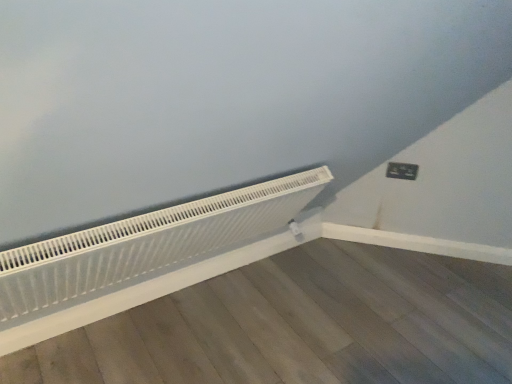
Question: Does black plastic electric outlet at upper right have a lesser height compared to white matte radiator at lower left?

Choices:
 (A) yes
 (B) no

Answer: (A)

Question: Is black plastic electric outlet at upper right not within white matte radiator at lower left?

Choices:
 (A) yes
 (B) no

Answer: (A)

Question: Is black plastic electric outlet at upper right placed right next to white matte radiator at lower left?

Choices:
 (A) yes
 (B) no

Answer: (B)

Question: Considering the relative sizes of black plastic electric outlet at upper right and white matte radiator at lower left in the image provided, is black plastic electric outlet at upper right bigger than white matte radiator at lower left?

Choices:
 (A) yes
 (B) no

Answer: (B)

Question: Is black plastic electric outlet at upper right surrounding white matte radiator at lower left?

Choices:
 (A) yes
 (B) no

Answer: (B)

Question: Does black plastic electric outlet at upper right appear on the left side of white matte radiator at lower left?

Choices:
 (A) yes
 (B) no

Answer: (B)

Question: Considering the relative positions of white matte radiator at lower left and black plastic electric outlet at upper right in the image provided, is white matte radiator at lower left to the right of black plastic electric outlet at upper right from the viewer's perspective?

Choices:
 (A) yes
 (B) no

Answer: (B)

Question: From the image's perspective, would you say white matte radiator at lower left is shown under black plastic electric outlet at upper right?

Choices:
 (A) no
 (B) yes

Answer: (B)

Question: Can you confirm if white matte radiator at lower left is thinner than black plastic electric outlet at upper right?

Choices:
 (A) no
 (B) yes

Answer: (A)

Question: Is white matte radiator at lower left facing towards black plastic electric outlet at upper right?

Choices:
 (A) no
 (B) yes

Answer: (A)

Question: Is white matte radiator at lower left taller than black plastic electric outlet at upper right?

Choices:
 (A) yes
 (B) no

Answer: (A)

Question: From the image's perspective, is white matte radiator at lower left above black plastic electric outlet at upper right?

Choices:
 (A) yes
 (B) no

Answer: (B)

Question: From a real-world perspective, is black plastic electric outlet at upper right positioned above or below white matte radiator at lower left?

Choices:
 (A) above
 (B) below

Answer: (A)